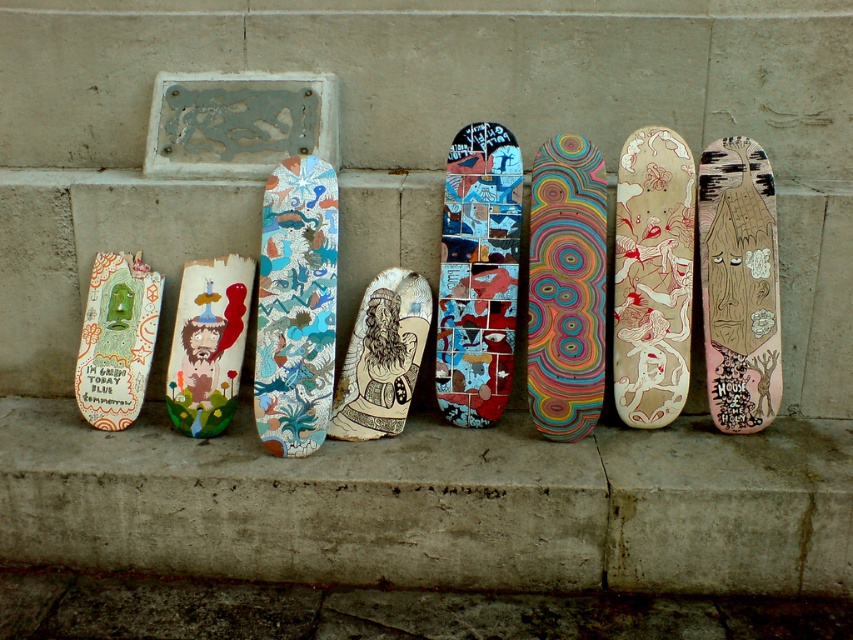
Question: Among these objects, which one is nearest to the camera?

Choices:
 (A) matte green skateboard at left
 (B) beige wood skateboard at center

Answer: (B)

Question: Which of the following is the farthest from the observer?

Choices:
 (A) pink wood skateboard at right
 (B) matte green skateboard at left

Answer: (B)

Question: Is multicolored painted skateboard at center bigger than black ink drawing at center?

Choices:
 (A) yes
 (B) no

Answer: (A)

Question: Does shiny metallic skateboard at center have a larger size compared to matte wooden skateboard at center?

Choices:
 (A) no
 (B) yes

Answer: (B)

Question: Does shiny metallic skateboard at center appear under matte wooden skateboard at center?

Choices:
 (A) no
 (B) yes

Answer: (A)

Question: Which is farther from the multicolored painted skateboard at center?

Choices:
 (A) multicolored mosaic skateboard at center
 (B) matte green skateboard at left
 (C) matte wooden skateboard at center
 (D) black ink drawing at center

Answer: (B)